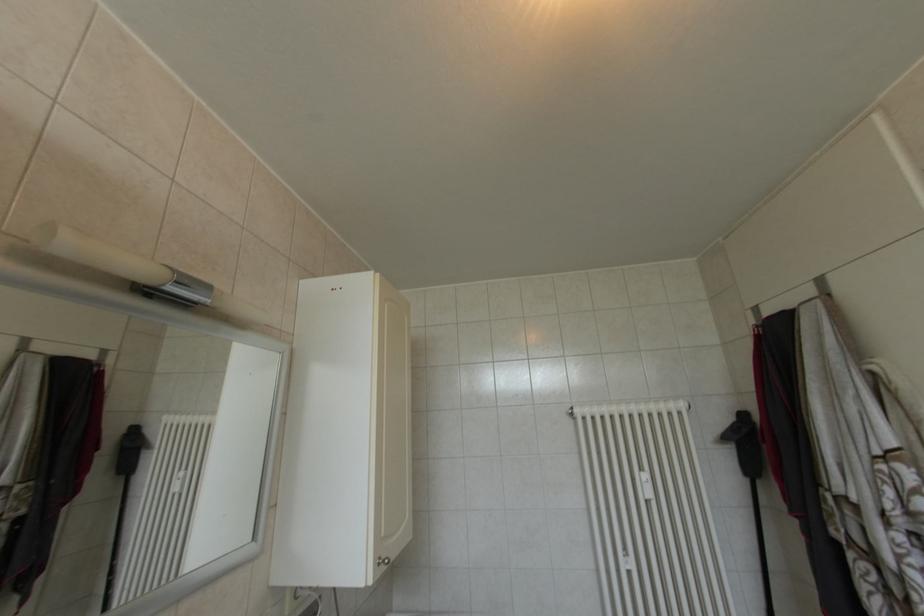
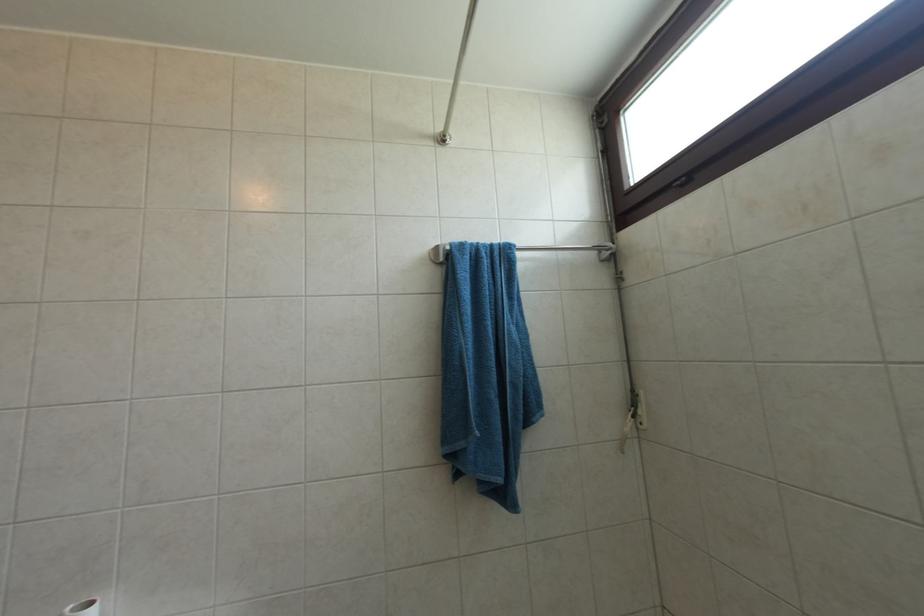
First-person continuous shooting, in which direction is the camera rotating?

The rotation direction of the camera is right-up.